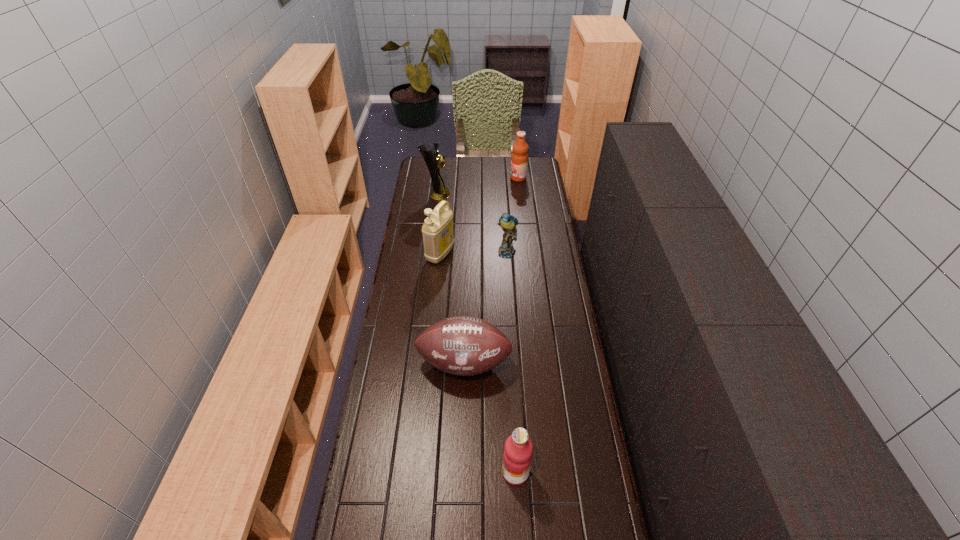
Find the location of a particular element. This screenshot has height=540, width=960. vacant region between the football (American) and the detergent is located at coordinates (452, 309).

Find the location of a particular element. This screenshot has width=960, height=540. free spot between the detergent and the fifth farthest object is located at coordinates (452, 309).

Identify which object is the third closest to the football (American). Please provide its 2D coordinates. Your answer should be formatted as a tuple, i.e. [(x, y)], where the tuple contains the x and y coordinates of a point satisfying the conditions above.

[(507, 222)]

Find the location of a particular element. object identified as the second closest to the award is located at coordinates (519, 159).

Find the location of a particular element. The image size is (960, 540). free spot that satisfies the following two spatial constraints: 1. on the face of the parrot; 2. on the label of the nearest object is located at coordinates (521, 472).